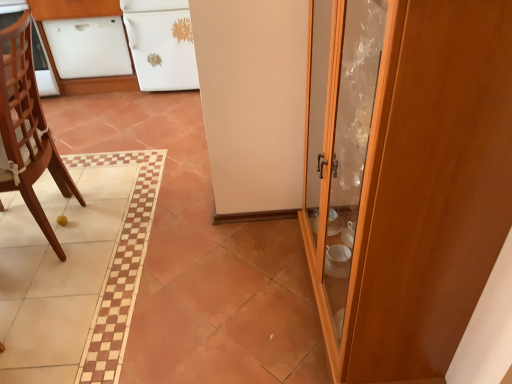
Question: Can you confirm if white glossy cabinet at upper left, the 2th cabinetry when ordered from left to right, is positioned to the right of wooden cabinet at right?

Choices:
 (A) no
 (B) yes

Answer: (A)

Question: Is white glossy cabinet at upper left, acting as the first cabinetry starting from the right, positioned before wooden cabinet at right?

Choices:
 (A) yes
 (B) no

Answer: (B)

Question: Is white glossy cabinet at upper left, the 2th cabinetry when ordered from left to right, smaller than wooden cabinet at right?

Choices:
 (A) no
 (B) yes

Answer: (B)

Question: From the image's perspective, is white glossy cabinet at upper left, the 2th cabinetry when ordered from left to right, below wooden cabinet at right?

Choices:
 (A) no
 (B) yes

Answer: (A)

Question: Considering the relative sizes of white glossy cabinet at upper left, acting as the first cabinetry starting from the right, and wooden cabinet at right in the image provided, is white glossy cabinet at upper left, acting as the first cabinetry starting from the right, wider than wooden cabinet at right?

Choices:
 (A) no
 (B) yes

Answer: (B)

Question: Can you confirm if white glossy cabinet at upper left, the 2th cabinetry when ordered from left to right, is shorter than wooden cabinet at right?

Choices:
 (A) no
 (B) yes

Answer: (B)

Question: Is the depth of wooden chair at left greater than that of white glossy dishwasher at upper left, acting as the 1th cabinetry starting from the left?

Choices:
 (A) no
 (B) yes

Answer: (A)

Question: Is wooden chair at left to the right of white glossy dishwasher at upper left, placed as the second cabinetry when sorted from right to left, from the viewer's perspective?

Choices:
 (A) no
 (B) yes

Answer: (B)

Question: Is wooden chair at left far away from white glossy dishwasher at upper left, acting as the 1th cabinetry starting from the left?

Choices:
 (A) no
 (B) yes

Answer: (B)

Question: From a real-world perspective, is wooden chair at left located beneath white glossy dishwasher at upper left, acting as the 1th cabinetry starting from the left?

Choices:
 (A) yes
 (B) no

Answer: (B)

Question: Can you confirm if wooden chair at left is shorter than white glossy dishwasher at upper left, placed as the second cabinetry when sorted from right to left?

Choices:
 (A) no
 (B) yes

Answer: (A)

Question: From the image's perspective, would you say wooden chair at left is shown under white glossy dishwasher at upper left, acting as the 1th cabinetry starting from the left?

Choices:
 (A) yes
 (B) no

Answer: (A)

Question: From the image's perspective, is white glossy cabinet at upper left, the 2th cabinetry when ordered from left to right, on white glossy dishwasher at upper left, acting as the 1th cabinetry starting from the left?

Choices:
 (A) no
 (B) yes

Answer: (B)